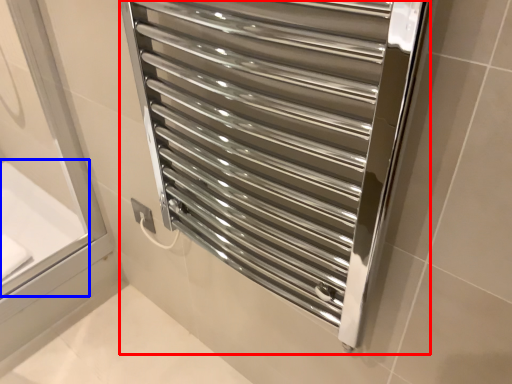
Question: Which object is further to the camera taking this photo, towel rack (highlighted by a red box) or bath (highlighted by a blue box)?

Choices:
 (A) towel rack
 (B) bath

Answer: (B)